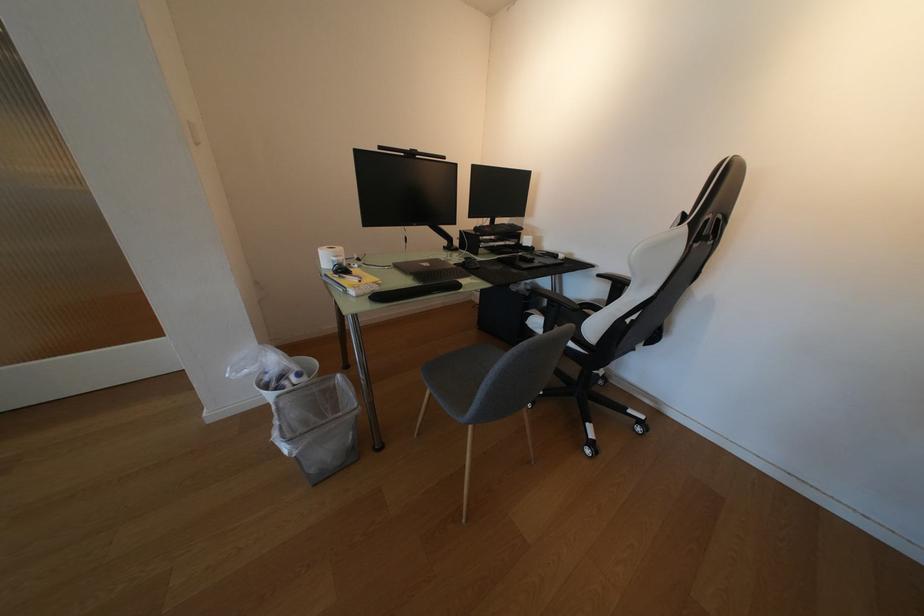
At what (x,y) coordinates should I click in order to perform the action: click on black chair armrest. Please return your answer as a coordinate pair (x, y). Image resolution: width=924 pixels, height=616 pixels. Looking at the image, I should click on (553, 313).